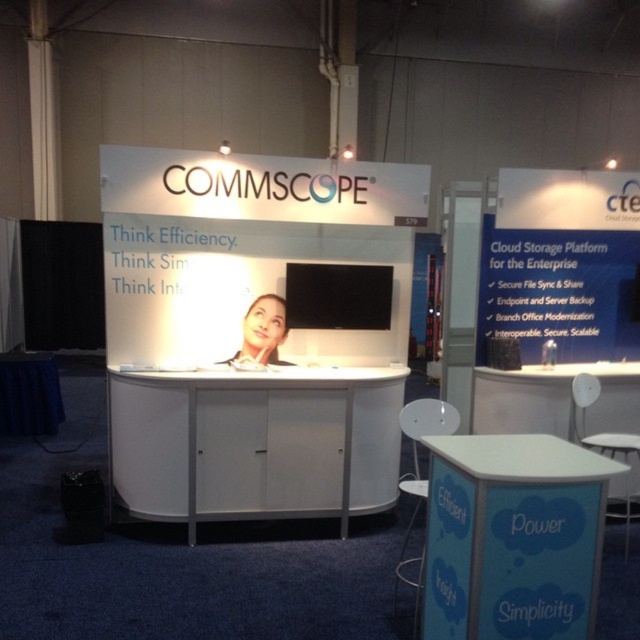
Can you confirm if blue fabric table at lower right is wider than smooth skin at center?

Correct, the width of blue fabric table at lower right exceeds that of smooth skin at center.

Does blue fabric table at lower right appear on the left side of smooth skin at center?

In fact, blue fabric table at lower right is to the right of smooth skin at center.

Is point (584, 634) farther from viewer compared to point (244, 344)?

No, (584, 634) is closer to viewer.

At what (x,y) coordinates should I click in order to perform the action: click on blue fabric table at lower right. Please return your answer as a coordinate pair (x, y). Image resolution: width=640 pixels, height=640 pixels. Looking at the image, I should click on (513, 536).

Does white plastic table at center lie behind smooth skin at center?

No, white plastic table at center is in front of smooth skin at center.

Does point (632, 392) come in front of point (248, 358)?

That is False.

Is point (502, 420) positioned after point (243, 321)?

Yes, it is behind point (243, 321).

Locate an element on the screen. Image resolution: width=640 pixels, height=640 pixels. white plastic table at center is located at coordinates (554, 397).

Can you confirm if white matte cabinet at center is taller than smooth skin at center?

Yes.

How distant is white matte cabinet at center from smooth skin at center?

white matte cabinet at center and smooth skin at center are 22.65 inches apart.

Consider the image. Who is more distant from viewer, [339,428] or [269,364]?

The point [269,364] is behind.

What are the coordinates of `white matte cabinet at center` in the screenshot? It's located at (256, 444).